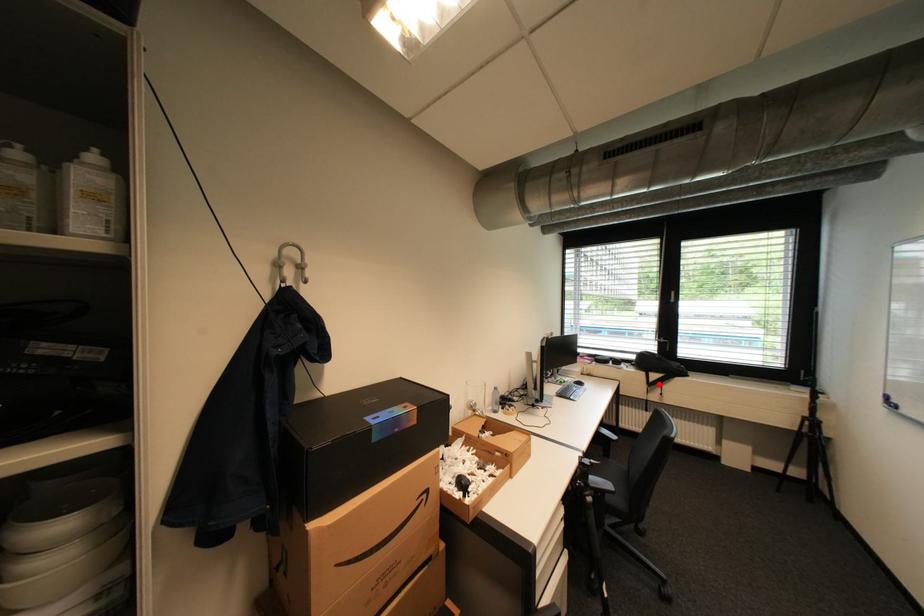
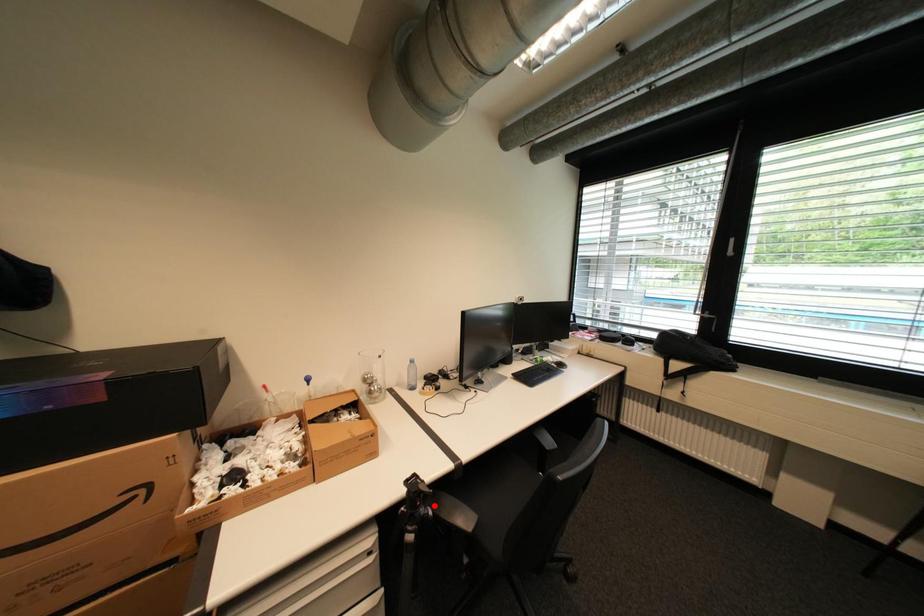
I am providing you with two images of the same scene from different viewpoints. A red point is marked on the first image and another point is marked on the second image. Do the highlighted points in image1 and image2 indicate the same real-world spot?

No